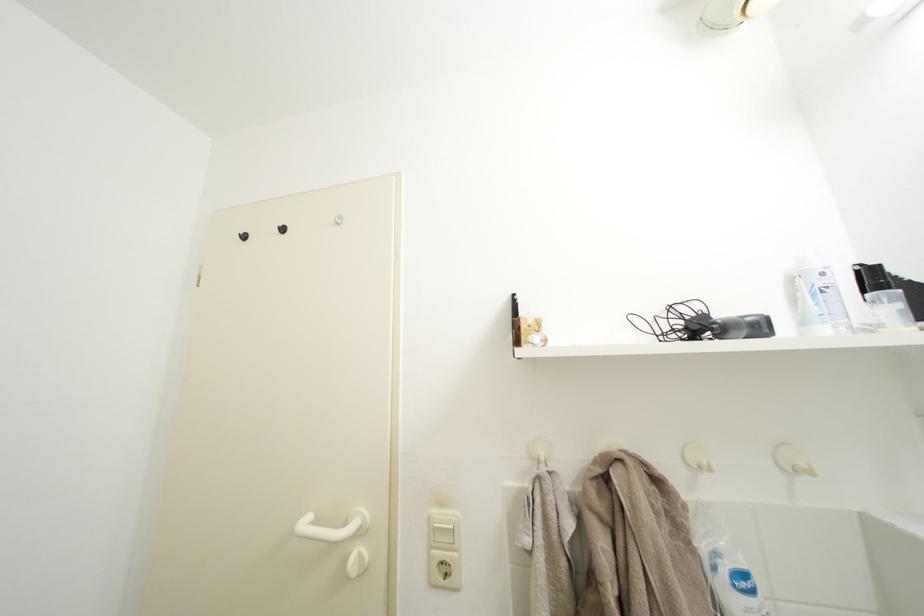
At what (x,y) coordinates should I click in order to perform the action: click on white door hook. Please return your answer as a coordinate pair (x, y). This screenshot has height=616, width=924. Looking at the image, I should click on pos(357,562).